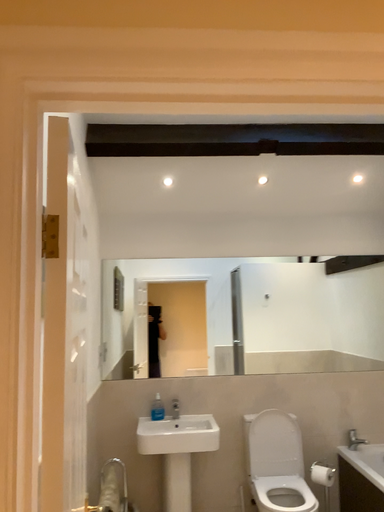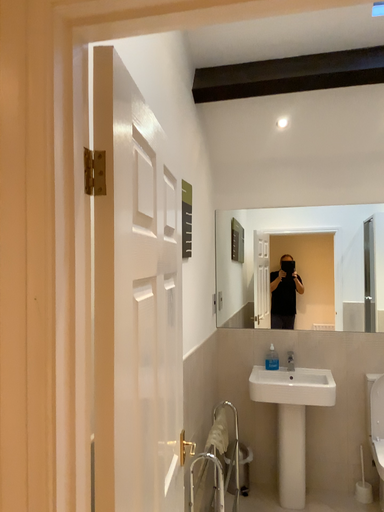
Question: How did the camera likely rotate when shooting the video?

Choices:
 (A) rotated left
 (B) rotated right

Answer: (A)